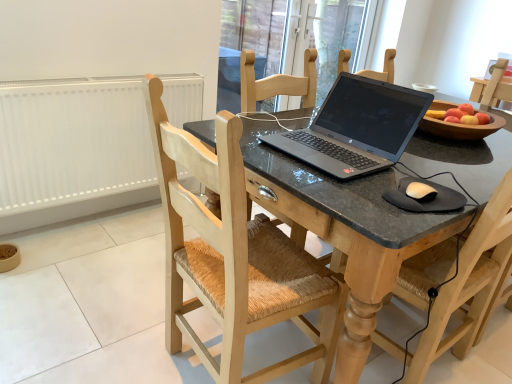
At what (x,y) coordinates should I click in order to perform the action: click on free region under white matte radiator at left (from a real-world perspective). Please return your answer as a coordinate pair (x, y). Looking at the image, I should click on (95, 218).